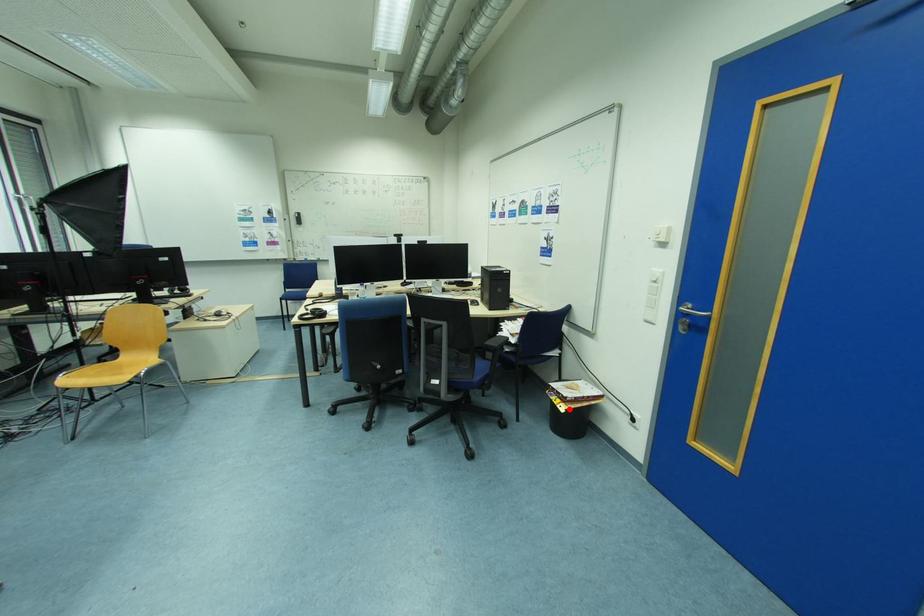
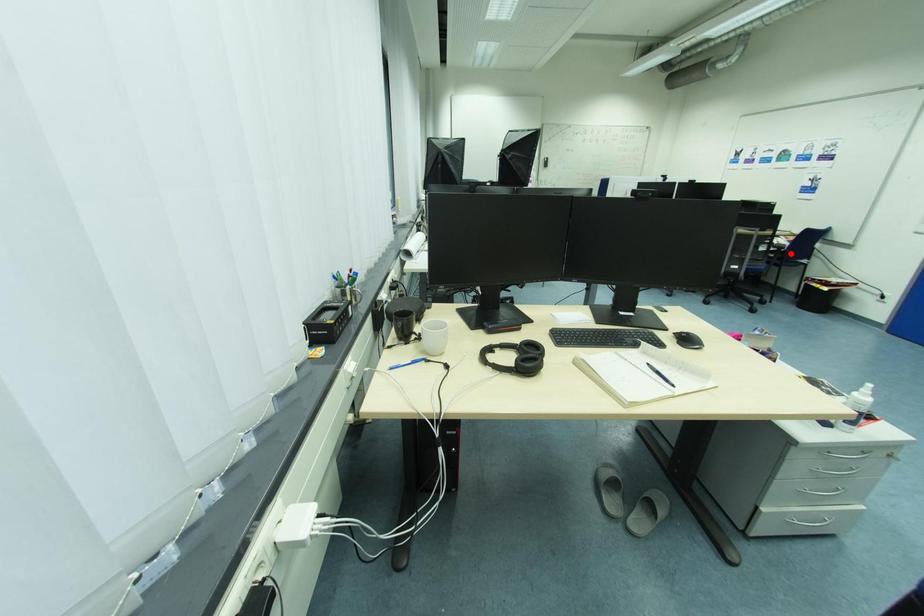
I am providing you with two images of the same scene from different viewpoints. A red point is marked on the first image and another point is marked on the second image. Are the points marked in image1 and image2 representing the same 3D position?

No